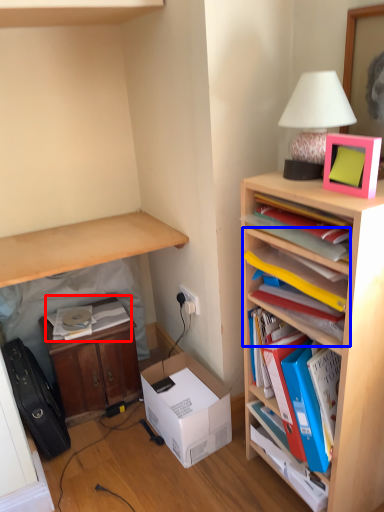
Question: Among these objects, which one is nearest to the camera, book (highlighted by a red box) or shelf (highlighted by a blue box)?

Choices:
 (A) book
 (B) shelf

Answer: (B)